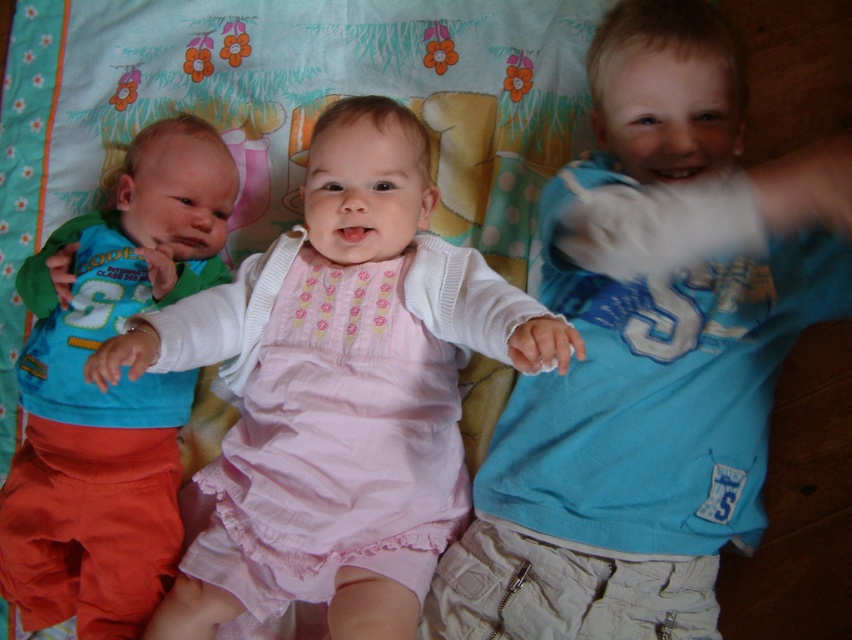
Can you confirm if blue cotton shirt at center is positioned to the right of matte blue shirt at left?

Indeed, blue cotton shirt at center is positioned on the right side of matte blue shirt at left.

Measure the distance from blue cotton shirt at center to matte blue shirt at left.

blue cotton shirt at center and matte blue shirt at left are 8.69 inches apart from each other.

Between point (582, 522) and point (363, 138), which one is positioned in front?

Point (582, 522) is more forward.

The width and height of the screenshot is (852, 640). What are the coordinates of `blue cotton shirt at center` in the screenshot? It's located at (639, 378).

Which of these two, blue cotton shirt at center or matte green t-shirt at left, stands shorter?

matte green t-shirt at left

Is the position of blue cotton shirt at center less distant than that of matte green t-shirt at left?

That is True.

Between point (625, 529) and point (170, 445), which one is positioned behind?

Positioned behind is point (170, 445).

Locate an element on the screen. blue cotton shirt at center is located at coordinates (639, 378).

Is matte blue shirt at left to the right of matte green t-shirt at left from the viewer's perspective?

Yes, matte blue shirt at left is to the right of matte green t-shirt at left.

Is point (246, 520) farther from viewer compared to point (58, 285)?

No, it is not.

You are a GUI agent. You are given a task and a screenshot of the screen. Output one action in this format:
    pyautogui.click(x=<x>, y=<y>)
    Task: Click on the matte blue shirt at left
    The width and height of the screenshot is (852, 640).
    Given the screenshot: What is the action you would take?
    pyautogui.click(x=341, y=390)